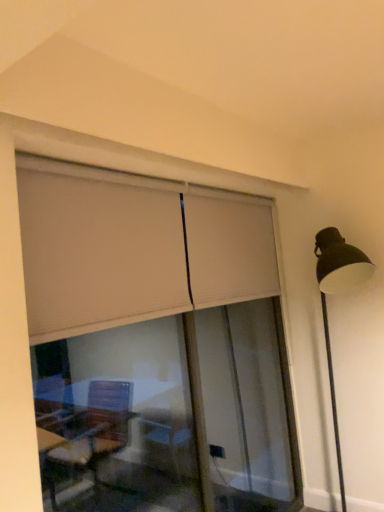
Question: Does beige fabric curtain at upper center have a greater width compared to matte black lamp post at right?

Choices:
 (A) yes
 (B) no

Answer: (B)

Question: Are beige fabric curtain at upper center and matte black lamp post at right far apart?

Choices:
 (A) yes
 (B) no

Answer: (B)

Question: Is beige fabric curtain at upper center to the right of matte black lamp post at right from the viewer's perspective?

Choices:
 (A) yes
 (B) no

Answer: (B)

Question: Considering the relative positions of beige fabric curtain at upper center and matte black lamp post at right in the image provided, is beige fabric curtain at upper center to the left of matte black lamp post at right from the viewer's perspective?

Choices:
 (A) yes
 (B) no

Answer: (A)

Question: Are beige fabric curtain at upper center and matte black lamp post at right beside each other?

Choices:
 (A) yes
 (B) no

Answer: (B)

Question: From the image's perspective, is beige fabric curtain at upper center above matte black lamp post at right?

Choices:
 (A) yes
 (B) no

Answer: (A)

Question: Is matte black lamp post at right beside beige fabric curtain at upper center?

Choices:
 (A) no
 (B) yes

Answer: (A)

Question: From a real-world perspective, is matte black lamp post at right located higher than beige fabric curtain at upper center?

Choices:
 (A) no
 (B) yes

Answer: (A)

Question: Is beige fabric curtain at upper center at the back of matte black lamp post at right?

Choices:
 (A) yes
 (B) no

Answer: (B)

Question: From a real-world perspective, is matte black lamp post at right positioned under beige fabric curtain at upper center based on gravity?

Choices:
 (A) yes
 (B) no

Answer: (A)

Question: Can beige fabric curtain at upper center be found inside matte black lamp post at right?

Choices:
 (A) yes
 (B) no

Answer: (B)

Question: Does matte black lamp post at right have a lesser width compared to beige fabric curtain at upper center?

Choices:
 (A) no
 (B) yes

Answer: (A)

Question: Is white matte window frame at upper center completely or partially inside matte black lamp post at right?

Choices:
 (A) yes
 (B) no

Answer: (B)